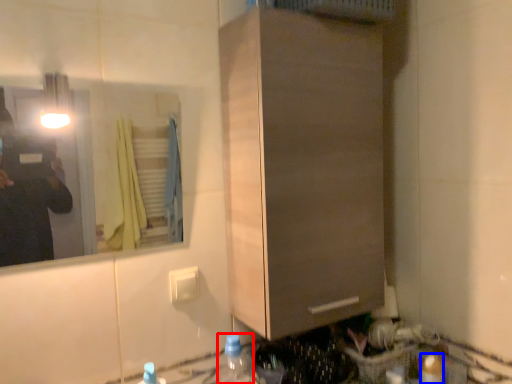
Question: Which object is closer to the camera taking this photo, bottle (highlighted by a red box) or bottle (highlighted by a blue box)?

Choices:
 (A) bottle
 (B) bottle

Answer: (A)